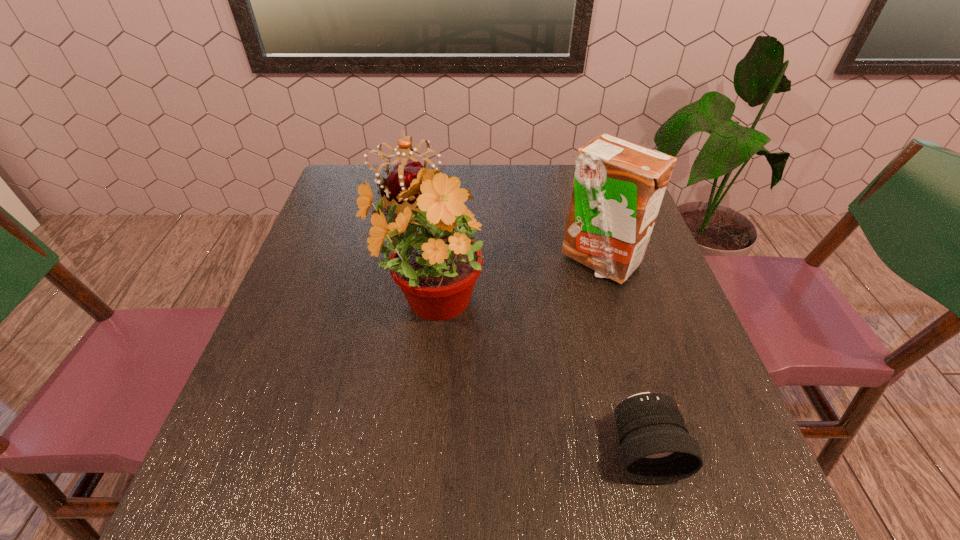
The width and height of the screenshot is (960, 540). In order to click on the tallest object in this screenshot , I will do `click(436, 266)`.

You are a GUI agent. You are given a task and a screenshot of the screen. Output one action in this format:
    pyautogui.click(x=<x>, y=<y>)
    Task: Click on the second tallest object
    Image resolution: width=960 pixels, height=540 pixels.
    Given the screenshot: What is the action you would take?
    pyautogui.click(x=618, y=187)

Where is `the third tallest object`? The width and height of the screenshot is (960, 540). the third tallest object is located at coordinates (403, 171).

Identify the location of the farthest object. (403, 171).

You are a GUI agent. You are given a task and a screenshot of the screen. Output one action in this format:
    pyautogui.click(x=<x>, y=<y>)
    Task: Click on the nearest object
    
    Given the screenshot: What is the action you would take?
    pyautogui.click(x=656, y=448)

At what (x,y) coordinates should I click in order to perform the action: click on the shortest object. Please return your answer as a coordinate pair (x, y). Looking at the image, I should click on (656, 448).

The image size is (960, 540). What are the coordinates of `free spot located on the right of the tallest object` in the screenshot? It's located at pyautogui.click(x=636, y=302).

This screenshot has width=960, height=540. Find the location of `vacant space situated on the straw side of the carton`. vacant space situated on the straw side of the carton is located at coordinates (643, 411).

This screenshot has height=540, width=960. Identify the location of vacant space located 0.380m on the front-facing side of the farthest object. (576, 198).

The width and height of the screenshot is (960, 540). Find the location of `vacant position located 0.050m at the front element of the telephoto lens`. vacant position located 0.050m at the front element of the telephoto lens is located at coordinates (661, 520).